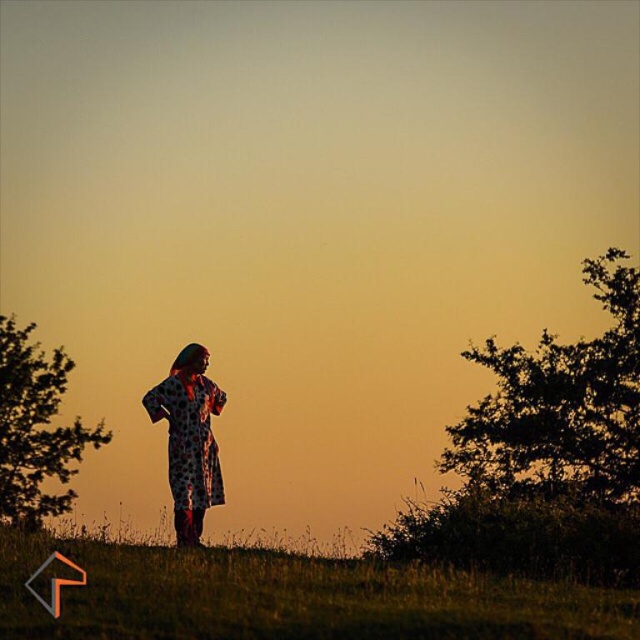
Can you confirm if dark green leafy tree at right is taller than printed fabric dress at center?

In fact, dark green leafy tree at right may be shorter than printed fabric dress at center.

Where is `dark green leafy tree at right`? This screenshot has width=640, height=640. dark green leafy tree at right is located at coordinates (561, 404).

At what (x,y) coordinates should I click in order to perform the action: click on dark green leafy tree at right. Please return your answer as a coordinate pair (x, y). Looking at the image, I should click on (561, 404).

Which is above, green grassy at lower center or green leafy tree at left?

green grassy at lower center

Who is shorter, green grassy at lower center or green leafy tree at left?

With less height is green grassy at lower center.

Which is behind, point (129, 611) or point (51, 371)?

Point (51, 371)

Where is `green grassy at lower center`? This screenshot has width=640, height=640. green grassy at lower center is located at coordinates (291, 598).

How distant is green grassy at lower center from dark green leafy tree at right?

They are 23.11 meters apart.

Who is positioned more to the right, green grassy at lower center or dark green leafy tree at right?

From the viewer's perspective, dark green leafy tree at right appears more on the right side.

Describe the element at coordinates (291, 598) in the screenshot. This screenshot has height=640, width=640. I see `green grassy at lower center` at that location.

This screenshot has width=640, height=640. I want to click on green grassy at lower center, so click(x=291, y=598).